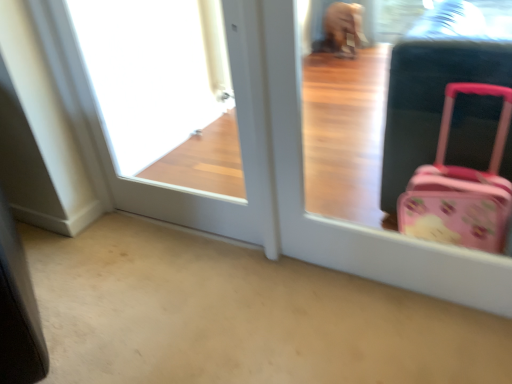
This screenshot has width=512, height=384. I want to click on free space in front of pink plastic suitcase at right, so click(406, 332).